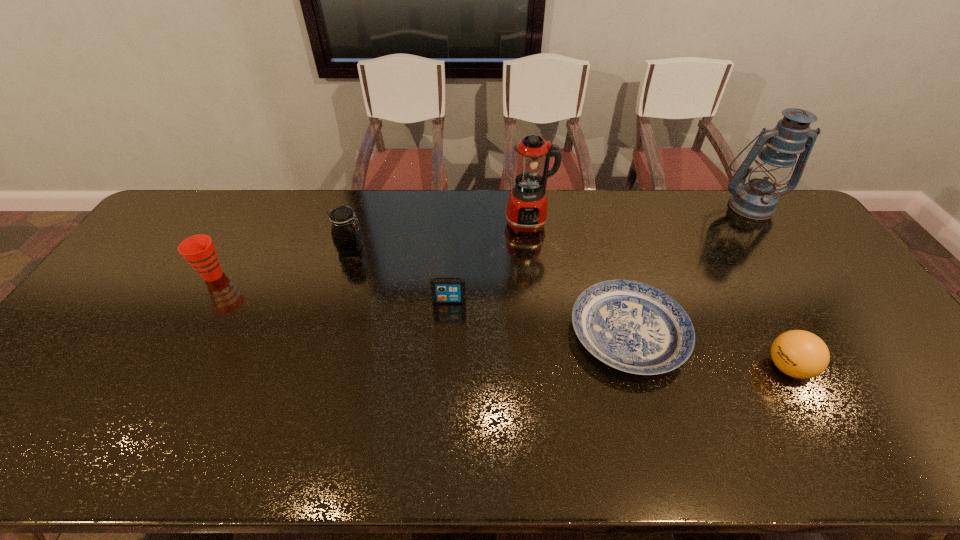
The height and width of the screenshot is (540, 960). I want to click on free spot located 0.210m on the front-facing side of the lantern, so click(790, 262).

The height and width of the screenshot is (540, 960). I want to click on vacant space located on the controls of the food processor, so 534,265.

Locate an element on the screen. vacant space located on the lid of the sixth object from right to left is located at coordinates (407, 247).

Locate an element on the screen. This screenshot has width=960, height=540. vacant point located on the front of the leftmost object is located at coordinates (152, 381).

This screenshot has height=540, width=960. What are the coordinates of `blank area located on the side with brand of the ping-pong ball` in the screenshot? It's located at (665, 367).

I want to click on vacant region located 0.330m on the side with brand of the ping-pong ball, so click(634, 367).

Where is `free spot located 0.270m on the side with brand of the ping-pong ball`? The image size is (960, 540). free spot located 0.270m on the side with brand of the ping-pong ball is located at coordinates (658, 367).

You are a GUI agent. You are given a task and a screenshot of the screen. Output one action in this format:
    pyautogui.click(x=<x>, y=<y>)
    Task: Click on the free space located on the front screen of the second shortest object
    
    Given the screenshot: What is the action you would take?
    pyautogui.click(x=440, y=441)

You are a GUI agent. You are given a task and a screenshot of the screen. Output one action in this format:
    pyautogui.click(x=<x>, y=<y>)
    Task: Click on the blank area located on the back of the plate
    
    Given the screenshot: What is the action you would take?
    pyautogui.click(x=603, y=247)

The height and width of the screenshot is (540, 960). Find the location of `lantern that is at the far edge`. lantern that is at the far edge is located at coordinates (757, 199).